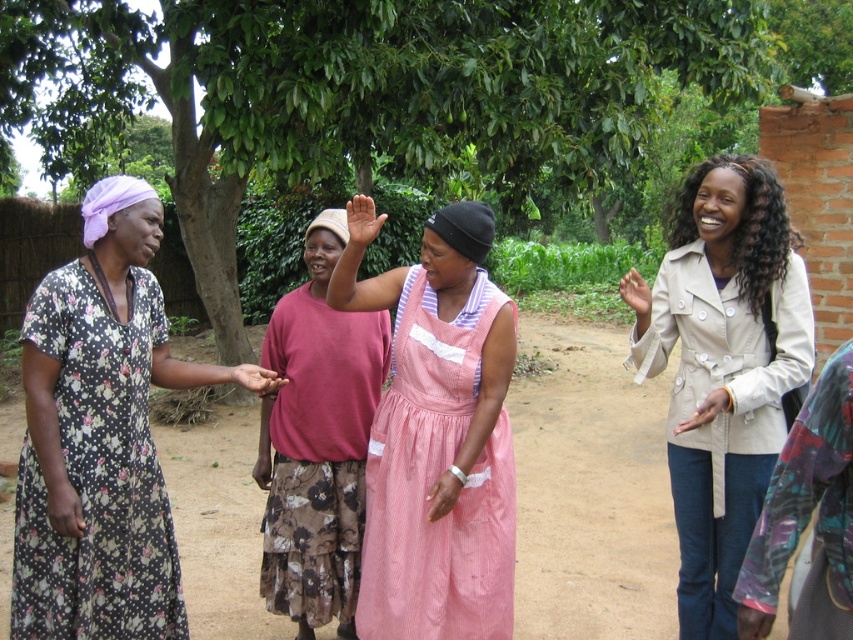
You are planning to plant a row of flowers in the brown dirt field at center. The beige cotton coat at upper right is hanging on a nearby tree. If the coat is 2 meters wide, can the field accommodate a flower bed that is 3 meters wide?

The brown dirt field at center is wider than the beige cotton coat at upper right. Since the coat is 2 meters wide, the field must be wider than 2 meters. Therefore, a 3 meter wide flower bed can fit in the brown dirt field at center.

You are standing at point (795, 392) and want to walk towards point (618, 614). Will you be moving forward or backward?

Since point (618, 614) is behind point (795, 392), you would be moving backward to reach it.